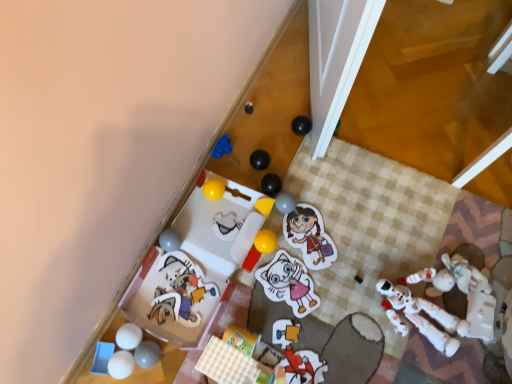
Locate an element on the screen. vacant area that lies between cartoon cat plush at lower left, positioned as the 5th toy in left-to-right order, and yellow matte block at upper center, which is the fifth toy in right-to-left order is located at coordinates point(226,243).